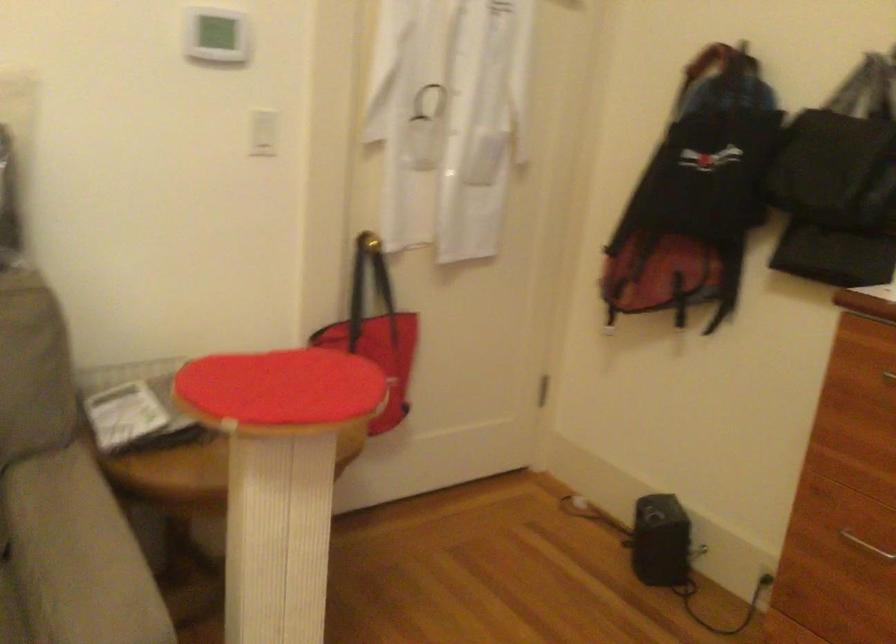
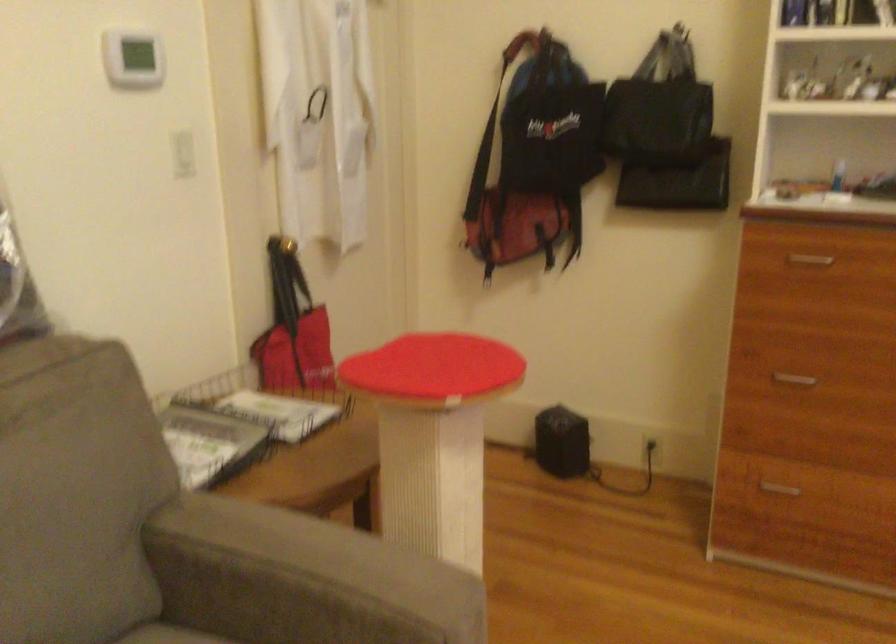
Where in the second image is the point corresponding to [288,386] from the first image?

(434, 366)